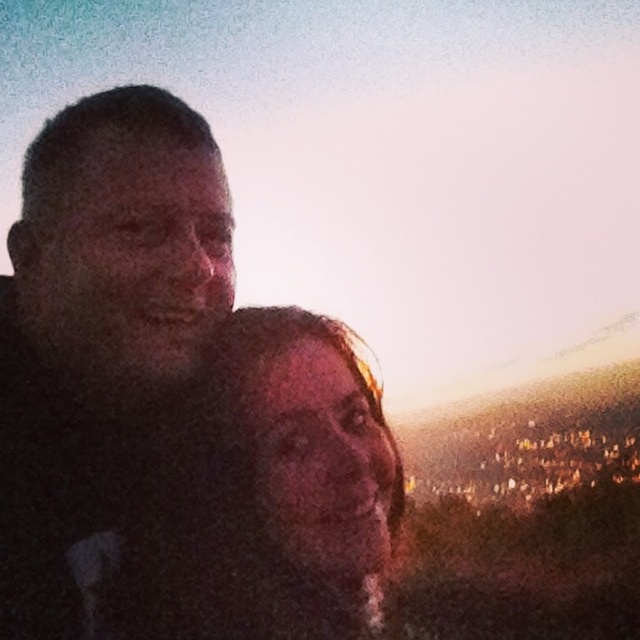
You are a photographer trying to capture a group photo of the dark matte face at left and the matte skin tone face at center. Based on their sizes in the image, which face should you focus on to ensure both are in sharp focus?

The dark matte face at left has a smaller size compared to matte skin tone face at center. To ensure both are in sharp focus, you should focus on the matte skin tone face at center since it is larger and likely closer to the camera.

You are a photographer trying to capture the scene. You notice two faces in the image. The dark matte face at left and the matte skin tone face at center. Which face is positioned higher in the frame?

The dark matte face at left is positioned higher in the frame than the matte skin tone face at center.